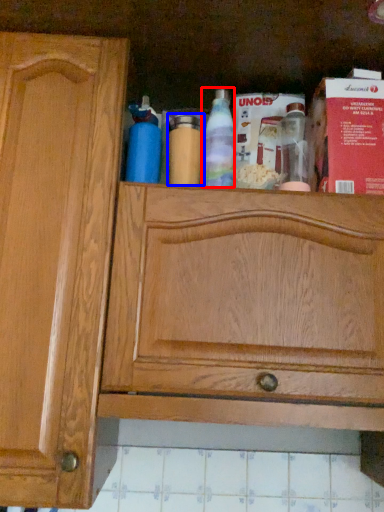
Question: Which object appears farthest to the camera in this image, bottle (highlighted by a red box) or bottle (highlighted by a blue box)?

Choices:
 (A) bottle
 (B) bottle

Answer: (B)